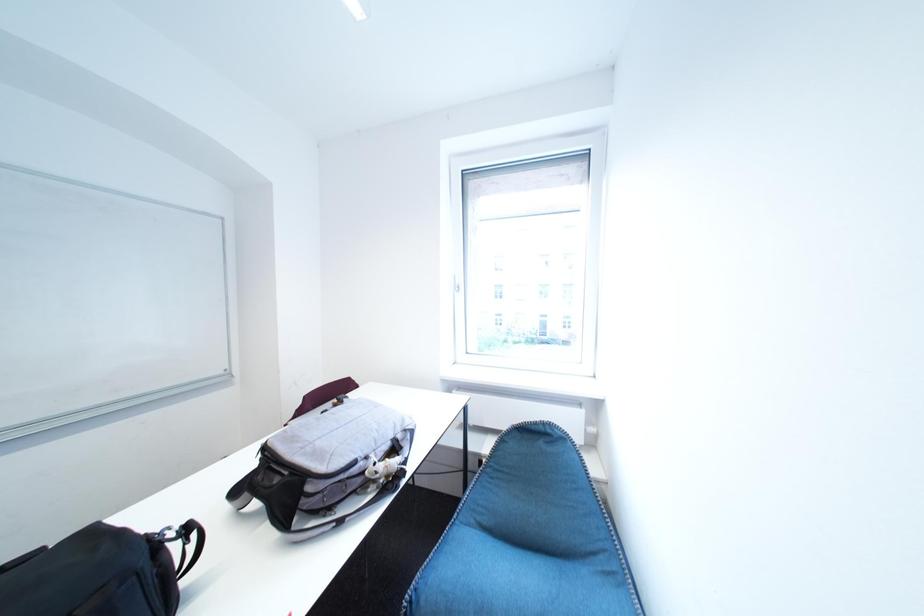
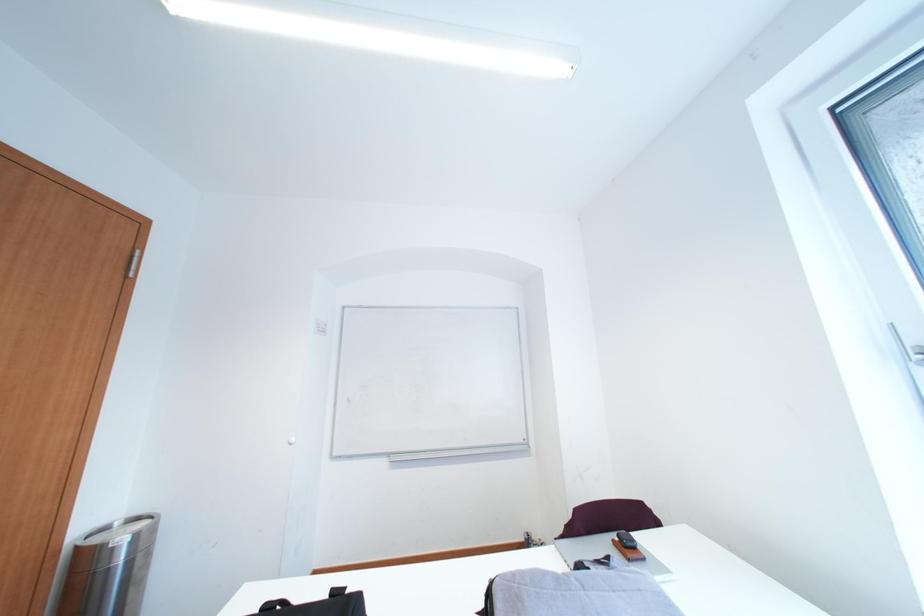
Question: How did the camera likely rotate?

Choices:
 (A) Left
 (B) Right
 (C) Up
 (D) Down

Answer: (A)